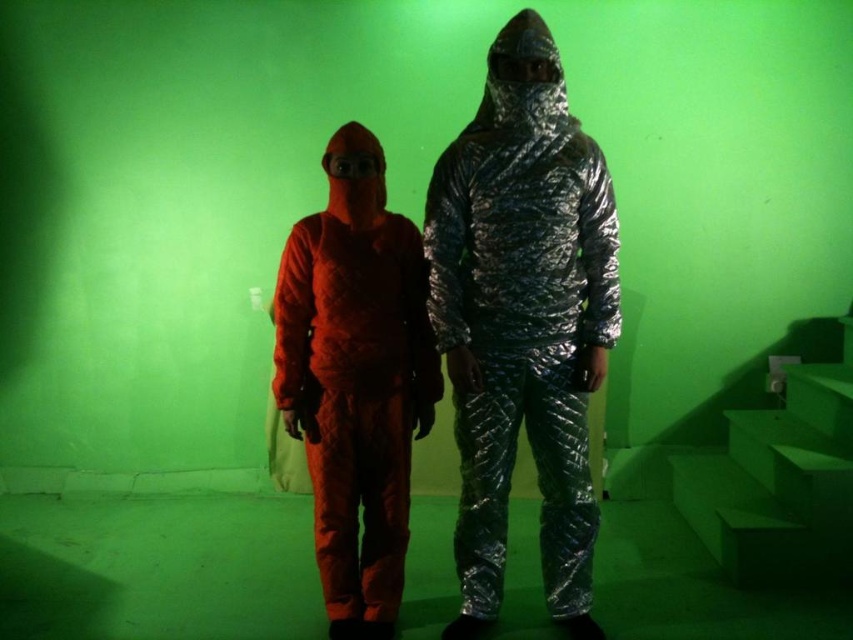
Who is lower down, shiny metallic suit at center or matte orange jumpsuit at center?

matte orange jumpsuit at center is below.

Is shiny metallic suit at center to the right of matte orange jumpsuit at center from the viewer's perspective?

Yes, shiny metallic suit at center is to the right of matte orange jumpsuit at center.

Find the location of a particular element. shiny metallic suit at center is located at coordinates (523, 321).